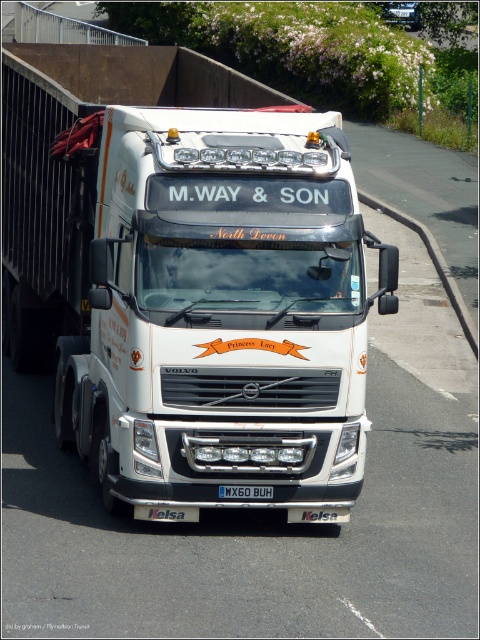
You are a delivery driver who needs to ensure the license plate is visible for safety checks. Based on the image, can you confirm if the black plastic license plate at center is obstructed by the white glossy truck at center?

The white glossy truck at center is in front of the black plastic license plate at center, so the license plate is obstructed and not visible for safety checks.

What are the coordinates of the white glossy truck at center?

The white glossy truck at center is located at coordinates point (222, 314).